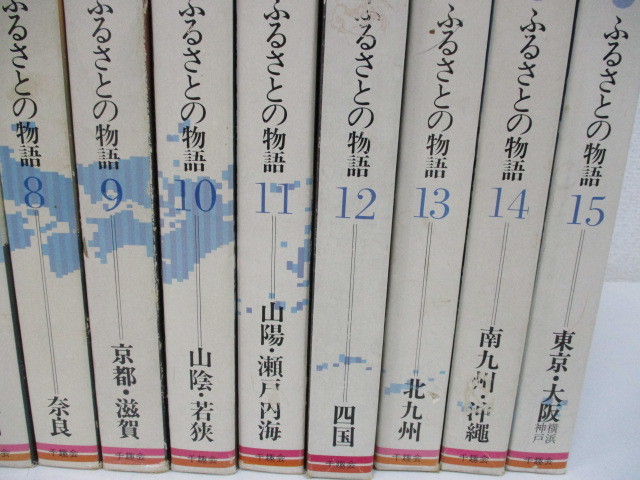
Locate an element on the screen. book 14 is located at coordinates (502, 237).